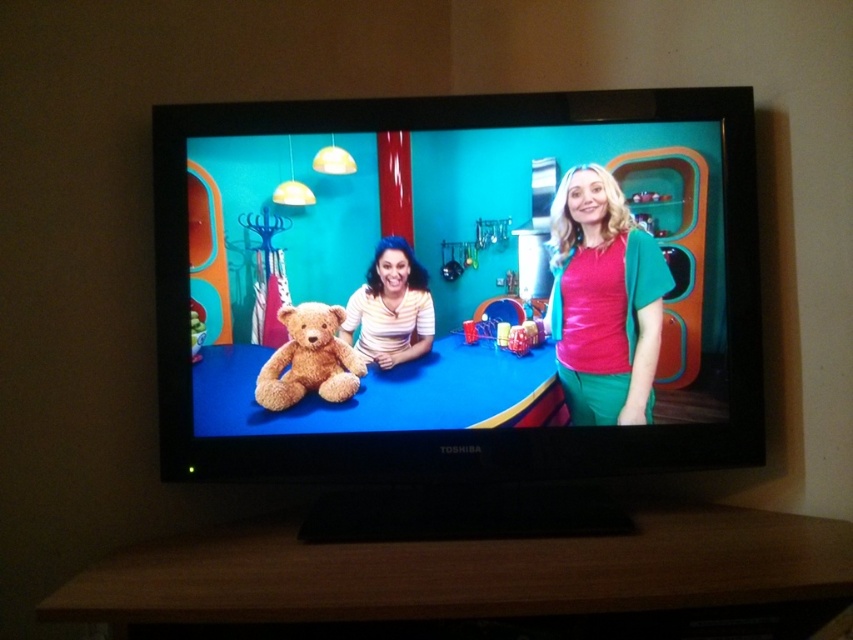
Who is positioned more to the left, brown plush bear at center or matte green skirt at center?

brown plush bear at center

Which is in front, point (691, 228) or point (573, 180)?

Point (691, 228)

Image resolution: width=853 pixels, height=640 pixels. What do you see at coordinates (457, 285) in the screenshot?
I see `brown plush bear at center` at bounding box center [457, 285].

Locate an element on the screen. The height and width of the screenshot is (640, 853). brown plush bear at center is located at coordinates (457, 285).

Which of these two, brown plush bear at center or brown plush teddy bear at center, stands taller?

Standing taller between the two is brown plush bear at center.

Between brown plush bear at center and brown plush teddy bear at center, which one is positioned lower?

brown plush teddy bear at center is below.

At what (x,y) coordinates should I click in order to perform the action: click on brown plush bear at center. Please return your answer as a coordinate pair (x, y). Looking at the image, I should click on (457, 285).

Locate an element on the screen. This screenshot has height=640, width=853. matte green skirt at center is located at coordinates (602, 300).

Between matte green skirt at center and brown plush teddy bear at center, which one has less height?

Standing shorter between the two is brown plush teddy bear at center.

This screenshot has height=640, width=853. Identify the location of matte green skirt at center. (602, 300).

You are a GUI agent. You are given a task and a screenshot of the screen. Output one action in this format:
    pyautogui.click(x=<x>, y=<y>)
    Task: Click on the matte green skirt at center
    
    Given the screenshot: What is the action you would take?
    pyautogui.click(x=602, y=300)